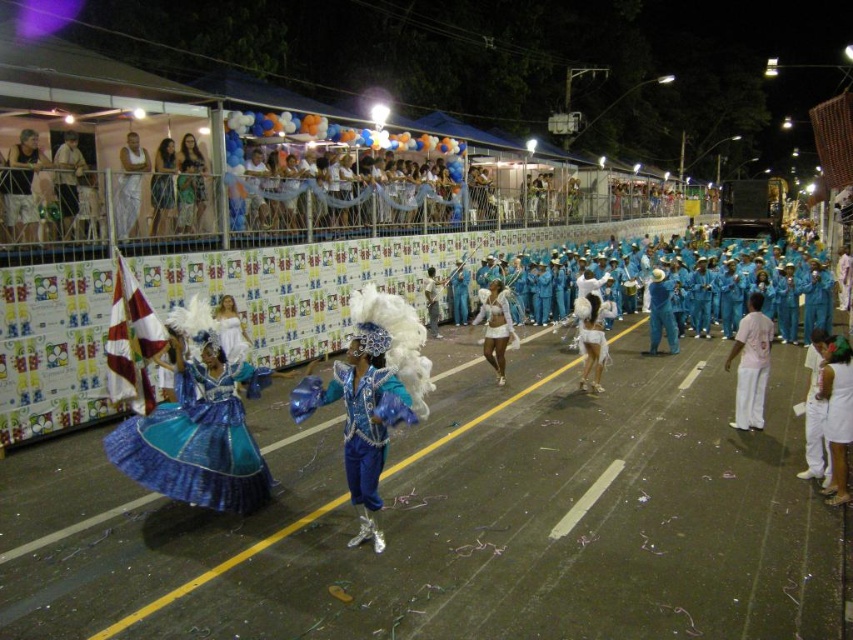
You are a photographer standing in the middle of the street during the nighttime parade. You want to take a photo of both the pink fabric pants at right and the white matte pants at right. Can you fit both subjects into your camera frame if your camera has a minimum required distance of 1 meter between subjects to capture them clearly?

The distance between the pink fabric pants at right and white matte pants at right is 99.71 centimeters, which is slightly less than the required 1 meter. Therefore, the camera may not be able to capture both subjects clearly in the same frame.

What is located at the coordinates point (496, 326) in the image?

The white satin dress at center is located at point (496, 326).